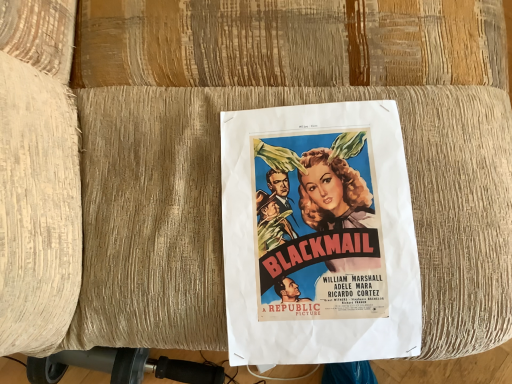
Question: Is black rubber vacuum at lower left wider than vintage paper poster at center?

Choices:
 (A) no
 (B) yes

Answer: (B)

Question: Is black rubber vacuum at lower left at the right side of vintage paper poster at center?

Choices:
 (A) yes
 (B) no

Answer: (B)

Question: Is black rubber vacuum at lower left outside of vintage paper poster at center?

Choices:
 (A) yes
 (B) no

Answer: (A)

Question: Does black rubber vacuum at lower left have a larger size compared to vintage paper poster at center?

Choices:
 (A) no
 (B) yes

Answer: (A)

Question: Is black rubber vacuum at lower left shorter than vintage paper poster at center?

Choices:
 (A) no
 (B) yes

Answer: (A)

Question: Is black rubber vacuum at lower left at the left side of vintage paper poster at center?

Choices:
 (A) yes
 (B) no

Answer: (A)

Question: Is the position of vintage paper poster at center more distant than that of black rubber vacuum at lower left?

Choices:
 (A) yes
 (B) no

Answer: (B)

Question: Is black rubber vacuum at lower left a part of vintage paper poster at center?

Choices:
 (A) no
 (B) yes

Answer: (A)

Question: From a real-world perspective, does vintage paper poster at center sit lower than black rubber vacuum at lower left?

Choices:
 (A) yes
 (B) no

Answer: (B)

Question: From the image's perspective, is vintage paper poster at center beneath black rubber vacuum at lower left?

Choices:
 (A) yes
 (B) no

Answer: (B)

Question: Is vintage paper poster at center turned away from black rubber vacuum at lower left?

Choices:
 (A) no
 (B) yes

Answer: (A)

Question: Could you tell me if vintage paper poster at center is facing black rubber vacuum at lower left?

Choices:
 (A) yes
 (B) no

Answer: (B)

Question: Would you say black rubber vacuum at lower left is to the left or to the right of vintage paper poster at center in the picture?

Choices:
 (A) left
 (B) right

Answer: (A)